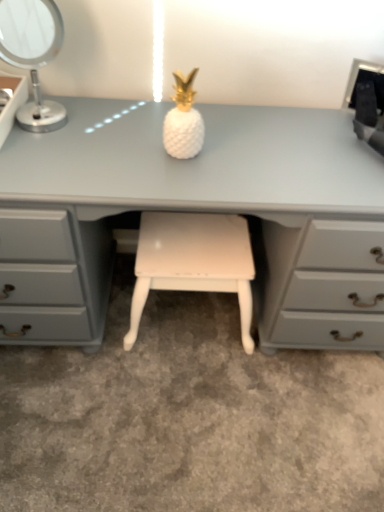
Question: From a real-world perspective, is silver metallic table lamp at upper left positioned under white painted wood stool at center based on gravity?

Choices:
 (A) no
 (B) yes

Answer: (A)

Question: From the image's perspective, would you say silver metallic table lamp at upper left is shown under white painted wood stool at center?

Choices:
 (A) yes
 (B) no

Answer: (B)

Question: From the image's perspective, would you say silver metallic table lamp at upper left is positioned over white painted wood stool at center?

Choices:
 (A) no
 (B) yes

Answer: (B)

Question: Is silver metallic table lamp at upper left facing away from white painted wood stool at center?

Choices:
 (A) yes
 (B) no

Answer: (B)

Question: Is silver metallic table lamp at upper left far away from white painted wood stool at center?

Choices:
 (A) yes
 (B) no

Answer: (B)

Question: Looking at the image, does white painted wood stool at center seem bigger or smaller compared to silver metallic table lamp at upper left?

Choices:
 (A) small
 (B) big

Answer: (B)

Question: Is white painted wood stool at center spatially inside silver metallic table lamp at upper left, or outside of it?

Choices:
 (A) inside
 (B) outside

Answer: (B)

Question: Relative to silver metallic table lamp at upper left, is white painted wood stool at center in front or behind?

Choices:
 (A) behind
 (B) front

Answer: (A)

Question: Does point (244, 270) appear closer or farther from the camera than point (51, 110)?

Choices:
 (A) farther
 (B) closer

Answer: (A)

Question: Considering the relative positions of black plastic desktop computer at upper right and white glossy pineapple at center in the image provided, is black plastic desktop computer at upper right to the left or to the right of white glossy pineapple at center?

Choices:
 (A) left
 (B) right

Answer: (B)

Question: From a real-world perspective, relative to white glossy pineapple at center, is black plastic desktop computer at upper right vertically above or below?

Choices:
 (A) above
 (B) below

Answer: (B)

Question: Considering the positions of black plastic desktop computer at upper right and white glossy pineapple at center in the image, is black plastic desktop computer at upper right taller or shorter than white glossy pineapple at center?

Choices:
 (A) short
 (B) tall

Answer: (A)

Question: Is point (355, 103) closer or farther from the camera than point (190, 116)?

Choices:
 (A) farther
 (B) closer

Answer: (A)

Question: From the image's perspective, is white painted wood stool at center above or below black plastic desktop computer at upper right?

Choices:
 (A) above
 (B) below

Answer: (B)

Question: Is white painted wood stool at center taller or shorter than black plastic desktop computer at upper right?

Choices:
 (A) short
 (B) tall

Answer: (B)